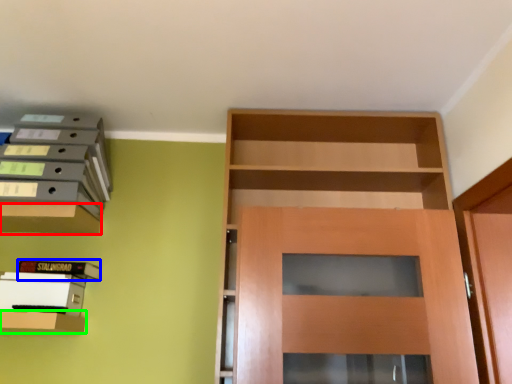
Question: Which object is the farthest from cabinetry (highlighted by a red box)? Choose among these: book (highlighted by a blue box) or shelf (highlighted by a green box).

Choices:
 (A) book
 (B) shelf

Answer: (B)